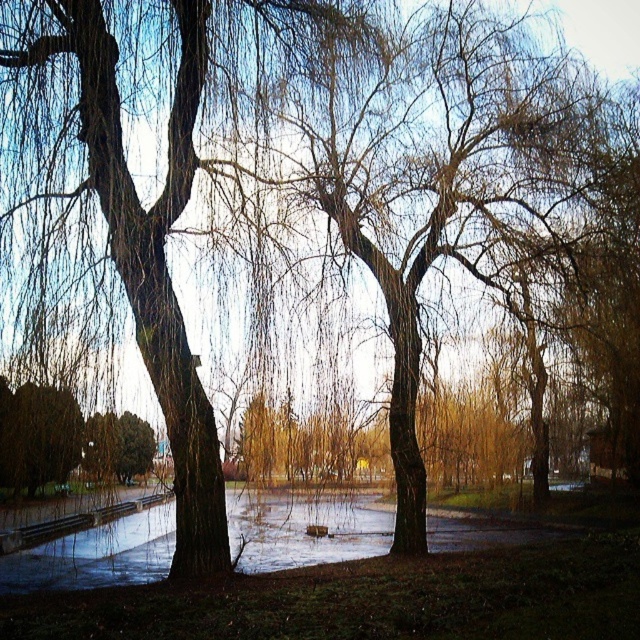
Question: Is brown textured tree at left thinner than smooth bark tree at center?

Choices:
 (A) yes
 (B) no

Answer: (B)

Question: Can you confirm if brown textured tree at left is smaller than smooth bark tree at center?

Choices:
 (A) no
 (B) yes

Answer: (A)

Question: Estimate the real-world distances between objects in this image. Which object is closer to the brown textured tree at left?

Choices:
 (A) smooth bark tree at center
 (B) green matte bush at lower left

Answer: (B)

Question: Which object is the farthest from the green matte bush at lower left?

Choices:
 (A) smooth bark tree at center
 (B) brown textured tree at left

Answer: (B)

Question: Which point is farther to the camera?

Choices:
 (A) (257, 6)
 (B) (561, 157)
 (C) (45, 400)

Answer: (B)

Question: Is smooth bark tree at center further to the viewer compared to green matte bush at lower left?

Choices:
 (A) no
 (B) yes

Answer: (A)